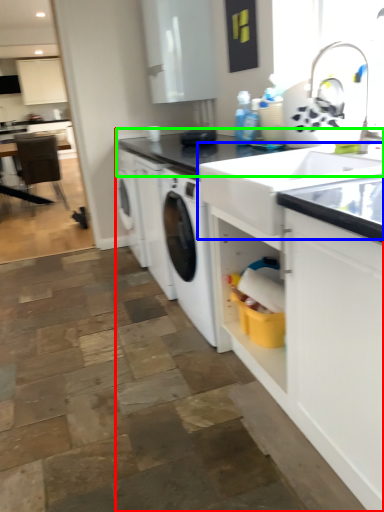
Question: Which is nearer to the countertop (highlighted by a red box)? sink (highlighted by a blue box) or countertop (highlighted by a green box).

Choices:
 (A) sink
 (B) countertop

Answer: (A)